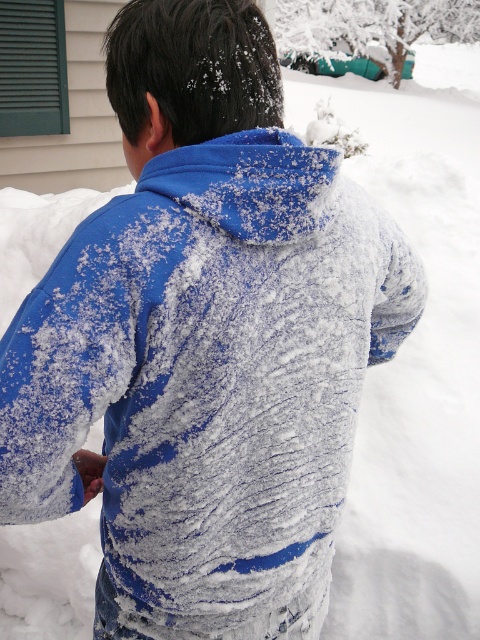
Does blue fleece jacket at center appear under white fluffy snowman at upper center?

Yes.

Which of these two, blue fleece jacket at center or white fluffy snowman at upper center, stands taller?

With more height is white fluffy snowman at upper center.

Between point (68, 294) and point (360, 140), which one is positioned in front?

Point (68, 294) is in front.

Where is `blue fleece jacket at center`? This screenshot has height=640, width=480. blue fleece jacket at center is located at coordinates (207, 371).